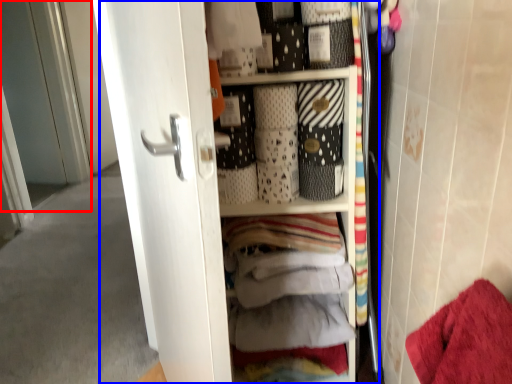
Question: Which object appears closest to the camera in this image, screen door (highlighted by a red box) or dresser (highlighted by a blue box)?

Choices:
 (A) screen door
 (B) dresser

Answer: (B)